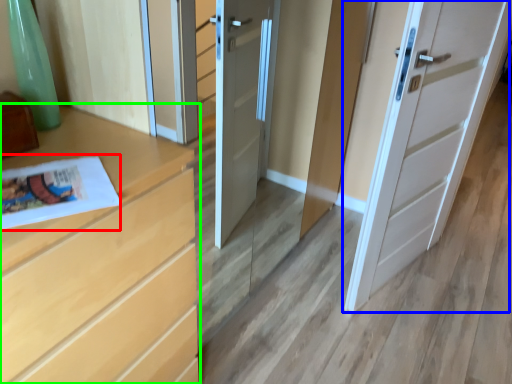
Question: Estimate the real-world distances between objects in this image. Which object is farther from magazine (highlighted by a red box), door (highlighted by a blue box) or chest of drawers (highlighted by a green box)?

Choices:
 (A) door
 (B) chest of drawers

Answer: (A)